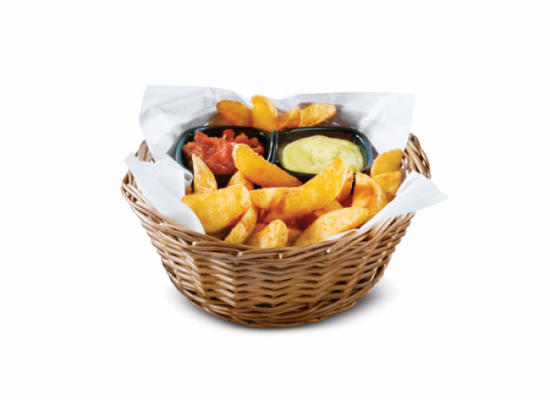
Find the location of a particular element. The height and width of the screenshot is (400, 550). rim of basket is located at coordinates (280, 251), (422, 147), (142, 149).